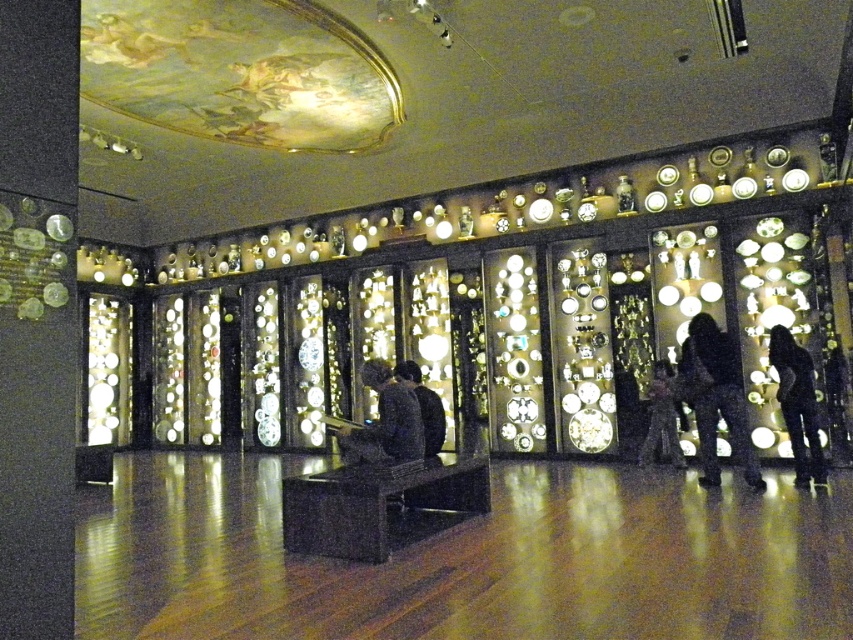
You are an art restorer standing in front of the black matte figure at lower right and the black fabric at center. You need to clean the objects in the order they are closest to you. Which object should you clean first?

The black matte figure at lower right should be cleaned first since it is closer to you than the black fabric at center, which is positioned behind it.

Looking at this image, you are a security guard in the museum and need to determine which object is taller between the black matte clothing at center and the black fabric at center. Based on their positions, which one is taller?

The black matte clothing at center is taller than the black fabric at center according to the description.

You are an interior designer assessing the layout of this clock collection exhibit. You notice the black matte figure at lower right and the black fabric at center. Which object is taller when viewed from the entrance?

The black matte figure at lower right is taller than the black fabric at center, so it appears taller when viewed from the entrance.